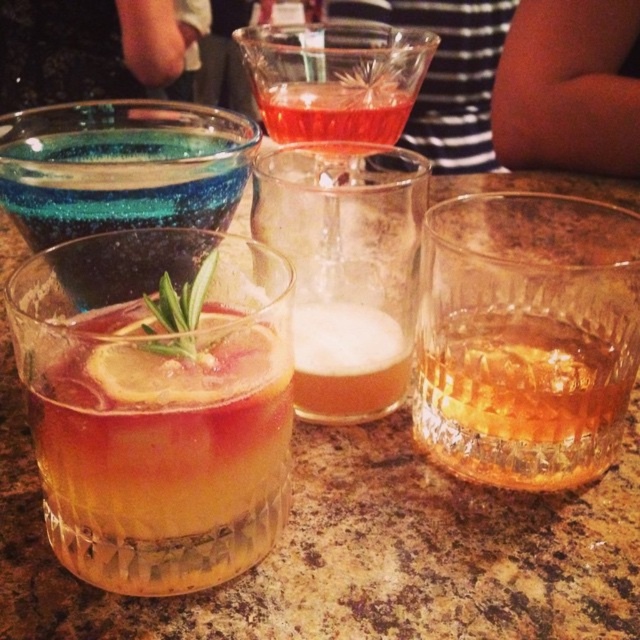
Question: Can you confirm if translucent glass drink at center is positioned below foamy amber liquid at center?

Choices:
 (A) no
 (B) yes

Answer: (B)

Question: Which object is closer to the camera taking this photo?

Choices:
 (A) translucent glass at upper center
 (B) blue glittery liquid at center left
 (C) green leafy rosemary at center
 (D) foamy amber liquid at center

Answer: (C)

Question: Which point is farther to the camera?

Choices:
 (A) (173, 324)
 (B) (67, 556)

Answer: (B)

Question: Where is foamy amber liquid at center located in relation to translucent glass at upper center in the image?

Choices:
 (A) left
 (B) right

Answer: (B)

Question: Does transparent glass with starburst etching at upper center come in front of green leafy rosemary at center?

Choices:
 (A) yes
 (B) no

Answer: (B)

Question: Which point is farther to the camera?

Choices:
 (A) blue glittery liquid at center left
 (B) foamy amber liquid at center
 (C) translucent glass at upper center

Answer: (C)